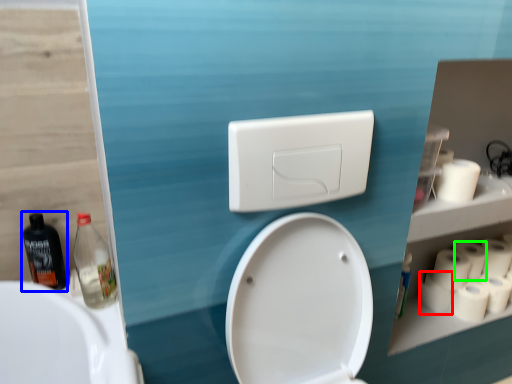
Question: Estimate the real-world distances between objects in this image. Which object is farther from toilet paper (highlighted by a red box), bottle (highlighted by a blue box) or toilet paper (highlighted by a green box)?

Choices:
 (A) bottle
 (B) toilet paper

Answer: (A)